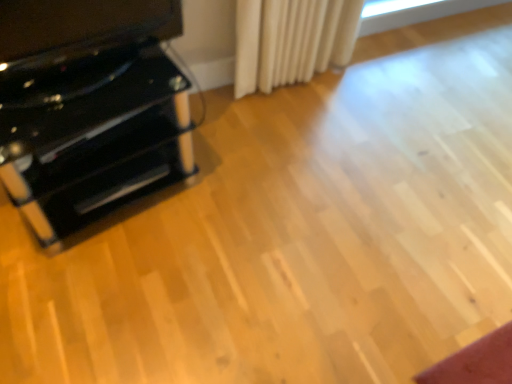
Question: Considering the relative sizes of black glossy tv stand at left and glossy black cabinet at left in the image provided, is black glossy tv stand at left shorter than glossy black cabinet at left?

Choices:
 (A) no
 (B) yes

Answer: (B)

Question: Is black glossy tv stand at left next to glossy black cabinet at left and touching it?

Choices:
 (A) yes
 (B) no

Answer: (B)

Question: Could you tell me if black glossy tv stand at left is turned towards glossy black cabinet at left?

Choices:
 (A) yes
 (B) no

Answer: (B)

Question: Would you say black glossy tv stand at left contains glossy black cabinet at left?

Choices:
 (A) yes
 (B) no

Answer: (B)

Question: Does black glossy tv stand at left have a larger size compared to glossy black cabinet at left?

Choices:
 (A) no
 (B) yes

Answer: (A)

Question: Is black glossy tv stand at left looking in the opposite direction of glossy black cabinet at left?

Choices:
 (A) no
 (B) yes

Answer: (A)

Question: Is glossy black cabinet at left shorter than black plastic drawer at left?

Choices:
 (A) yes
 (B) no

Answer: (B)

Question: Is glossy black cabinet at left closer to the viewer compared to black plastic drawer at left?

Choices:
 (A) yes
 (B) no

Answer: (A)

Question: Considering the relative positions of glossy black cabinet at left and black plastic drawer at left in the image provided, is glossy black cabinet at left behind black plastic drawer at left?

Choices:
 (A) no
 (B) yes

Answer: (A)

Question: Is glossy black cabinet at left surrounding black plastic drawer at left?

Choices:
 (A) yes
 (B) no

Answer: (A)

Question: Does glossy black cabinet at left have a smaller size compared to black plastic drawer at left?

Choices:
 (A) yes
 (B) no

Answer: (B)

Question: Does glossy black cabinet at left have a greater width compared to black plastic drawer at left?

Choices:
 (A) yes
 (B) no

Answer: (A)

Question: Does black plastic drawer at left appear on the right side of glossy black cabinet at left?

Choices:
 (A) no
 (B) yes

Answer: (B)